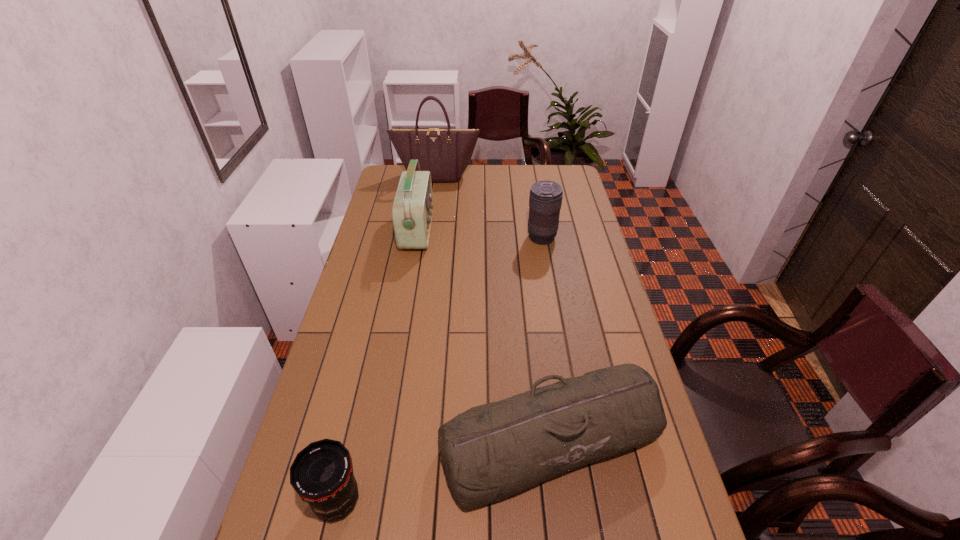
Locate an element on the screen. This screenshot has height=540, width=960. free space between the farthest object and the duffel bag is located at coordinates (493, 308).

The width and height of the screenshot is (960, 540). Identify the location of free space between the left telephoto lens and the farthest object. (387, 338).

This screenshot has height=540, width=960. What are the coordinates of `vacant space in between the farther telephoto lens and the second tallest object` in the screenshot? It's located at (479, 234).

Identify the location of vacant region between the taller telephoto lens and the nearer telephoto lens. (440, 369).

Where is `object that is the second nearest to the farther telephoto lens`? The width and height of the screenshot is (960, 540). object that is the second nearest to the farther telephoto lens is located at coordinates (446, 153).

Identify which object is located as the third nearest to the right telephoto lens. Please provide its 2D coordinates. Your answer should be formatted as a tuple, i.e. [(x, y)], where the tuple contains the x and y coordinates of a point satisfying the conditions above.

[(492, 451)]

You are a GUI agent. You are given a task and a screenshot of the screen. Output one action in this format:
    pyautogui.click(x=<x>, y=<y>)
    Task: Click on the free space that satisfies the following two spatial constraints: 1. on the front-facing side of the farthest object; 2. on the front panel of the radio receiver
    
    Given the screenshot: What is the action you would take?
    pyautogui.click(x=429, y=231)

You are a GUI agent. You are given a task and a screenshot of the screen. Output one action in this format:
    pyautogui.click(x=<x>, y=<y>)
    Task: Click on the vacant space that satisfies the following two spatial constraints: 1. on the side of the farther telephoto lens where the control switches are located; 2. on the front side of the nearer telephoto lens
    
    Given the screenshot: What is the action you would take?
    pyautogui.click(x=587, y=501)

The height and width of the screenshot is (540, 960). I want to click on vacant position in the image that satisfies the following two spatial constraints: 1. on the front panel of the radio receiver; 2. on the right side of the duffel bag, so click(x=380, y=441).